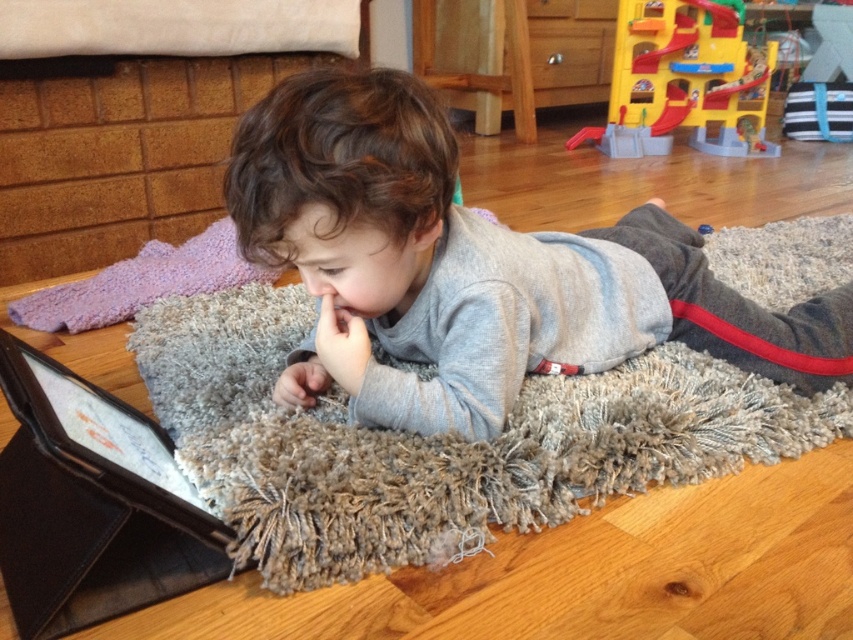
You are a parent trying to place a new toy between the gray soft fabric at center and the yellow plastic playset at upper right. The toy requires a minimum of 2 meters of space. Can you fit it between them?

The gray soft fabric at center and yellow plastic playset at upper right are 2.14 meters apart from each other, so yes, the toy can be placed between them as the distance is sufficient.

You are a parent looking to place a new rectangular toy box that is 2 feet wide between the gray soft fabric at center and the yellow plastic playset at upper right. Based on their widths, can the toy box fit between them without overlapping?

The gray soft fabric at center might be wider than yellow plastic playset at upper right, but since the exact widths aren not provided, it is uncertain if the 2 feet wide toy box can fit between them without overlapping. Check the actual measurements first.

You are a parent trying to clear space for a new large toy. You see the gray soft fabric at center and the yellow plastic playset at upper right. Which object should you move to free up more space?

The gray soft fabric at center occupies less space than the yellow plastic playset at upper right, so moving the gray soft fabric at center would free up less space. To maximize space, move the yellow plastic playset at upper right since it takes up more area.